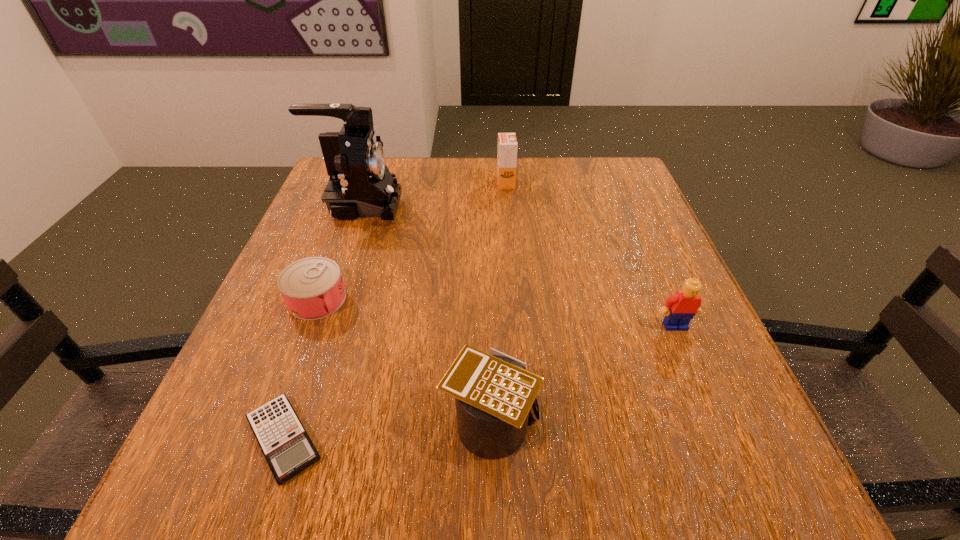
The image size is (960, 540). What are the coordinates of `object situated at the near left corner` in the screenshot? It's located at (288, 449).

The image size is (960, 540). In the image, there is a desktop. What are the coordinates of `vacant space at the far edge` in the screenshot? It's located at (469, 198).

In the image, there is a desktop. Where is `free region at the left edge`? This screenshot has width=960, height=540. free region at the left edge is located at coordinates (360, 267).

This screenshot has width=960, height=540. In the image, there is a desktop. What are the coordinates of `vacant space at the right edge` in the screenshot? It's located at (653, 244).

Find the location of a particular element. This screenshot has height=540, width=960. free location at the near left corner is located at coordinates (282, 494).

Identify the location of free space at the far right corner. This screenshot has width=960, height=540. (615, 164).

At what (x,y) coordinates should I click in order to perform the action: click on vacant area at the near right corner of the desktop. Please return your answer as a coordinate pair (x, y). This screenshot has width=960, height=540. Looking at the image, I should click on (788, 494).

At what (x,y) coordinates should I click in order to perform the action: click on vacant area between the shortest object and the orange juice. Please return your answer as a coordinate pair (x, y). This screenshot has height=540, width=960. Looking at the image, I should click on pyautogui.click(x=395, y=311).

The height and width of the screenshot is (540, 960). Identify the location of free spot between the shortest object and the orange juice. (395, 311).

The width and height of the screenshot is (960, 540). Find the location of `free space between the can and the camcorder`. free space between the can and the camcorder is located at coordinates click(x=338, y=253).